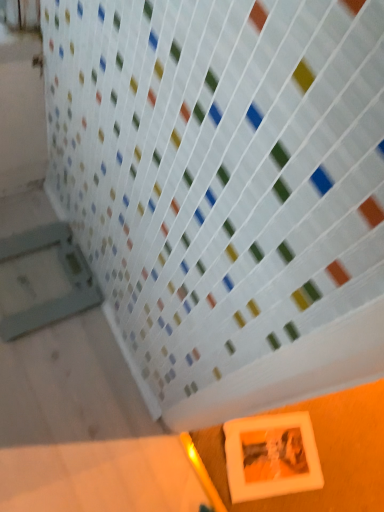
I want to click on empty space that is ontop of white matte picture frame at lower right (from a real-world perspective), so click(269, 448).